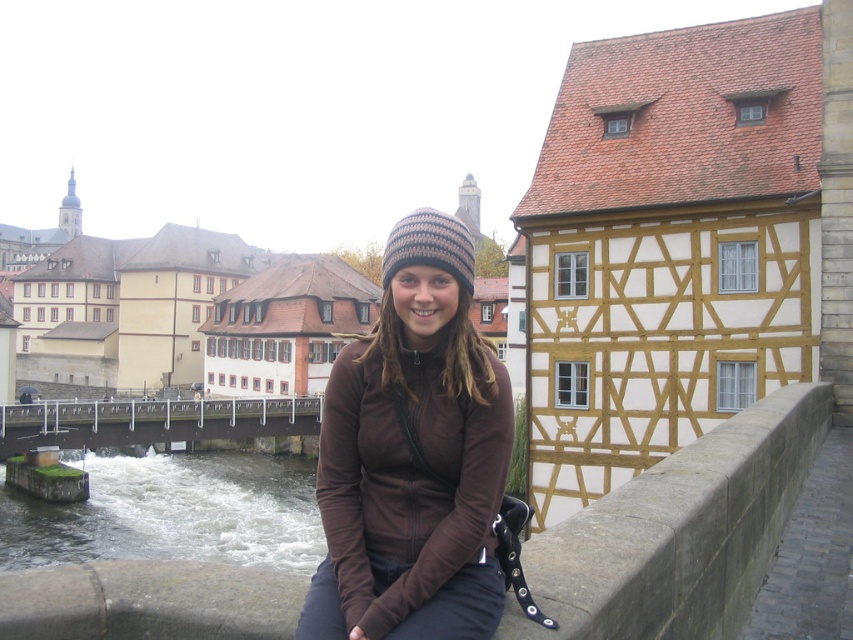
You are a tourist standing on the gray concrete ledge at lower center and want to take a photo of the matte brown building at upper left. Since the ledge is lower, will you need to look up or down to frame the building properly?

The gray concrete ledge at lower center is not as tall as the matte brown building at upper left, so you will need to look up to frame the matte brown building at upper left properly.

You are a tourist standing on the metallic gray bridge at lower left and want to take a photo of the white frothy water at lower left. Which direction should you move to face the water?

The white frothy water at lower left is positioned on the right side of the metallic gray bridge at lower left, so you should move to your right to face the water.